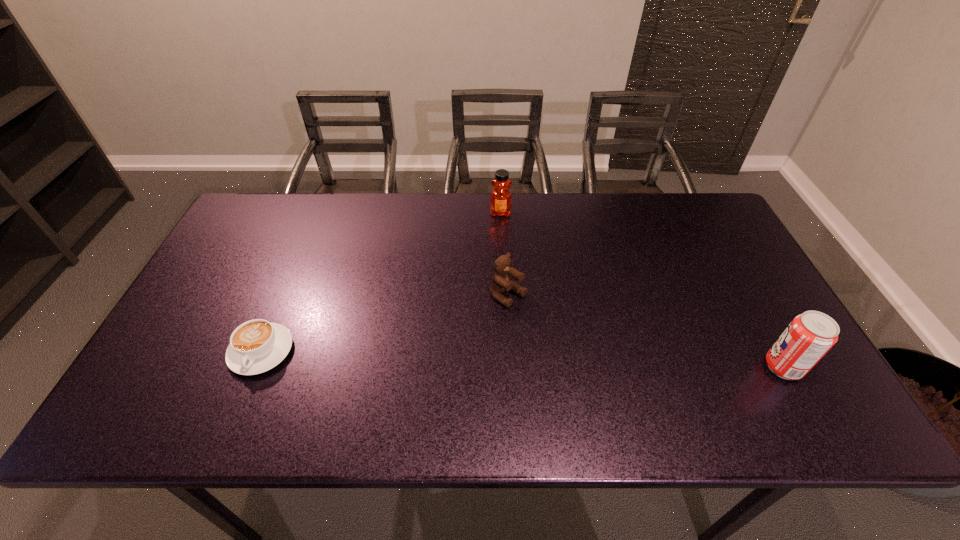
Find the location of a particular element. This screenshot has height=540, width=960. free space located on the face of the third tallest object is located at coordinates click(x=569, y=342).

I want to click on vacant position located on the face of the third tallest object, so click(548, 326).

I want to click on vacant space located 0.260m on the face of the third tallest object, so click(603, 367).

What are the coordinates of `object located in the far edge section of the desktop` in the screenshot? It's located at (500, 200).

The image size is (960, 540). What are the coordinates of `cappuccino that is at the near edge` in the screenshot? It's located at (256, 346).

Find the location of a particular element. This screenshot has height=540, width=960. soda can located at the near edge is located at coordinates (809, 336).

Locate an element on the screen. The width and height of the screenshot is (960, 540). object situated at the right edge is located at coordinates (809, 336).

Locate an element on the screen. The image size is (960, 540). object that is at the near right corner is located at coordinates tap(809, 336).

Where is `vacant space at the far edge of the desktop`? This screenshot has height=540, width=960. vacant space at the far edge of the desktop is located at coordinates (413, 227).

The height and width of the screenshot is (540, 960). In order to click on vacant space at the near edge of the desktop in this screenshot , I will do `click(461, 360)`.